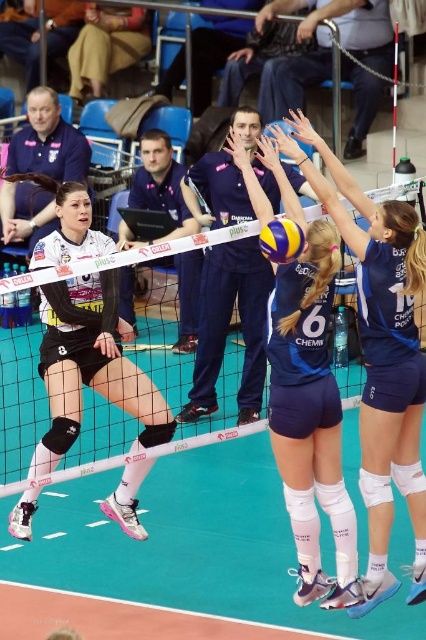
Based on the coordinates provided in the scene description, where exactly is the blue fabric shorts at center located?

The blue fabric shorts at center is located at point [380,355].

You are a referee watching the volleyball match. You need to determine if the blue fabric shorts at center and the matte black uniform at center are positioned correctly according to the court rules. Based on their positions, which one is closer to the right boundary line?

The blue fabric shorts at center is to the right of matte black uniform at center, so the blue fabric shorts at center is closer to the right boundary line.